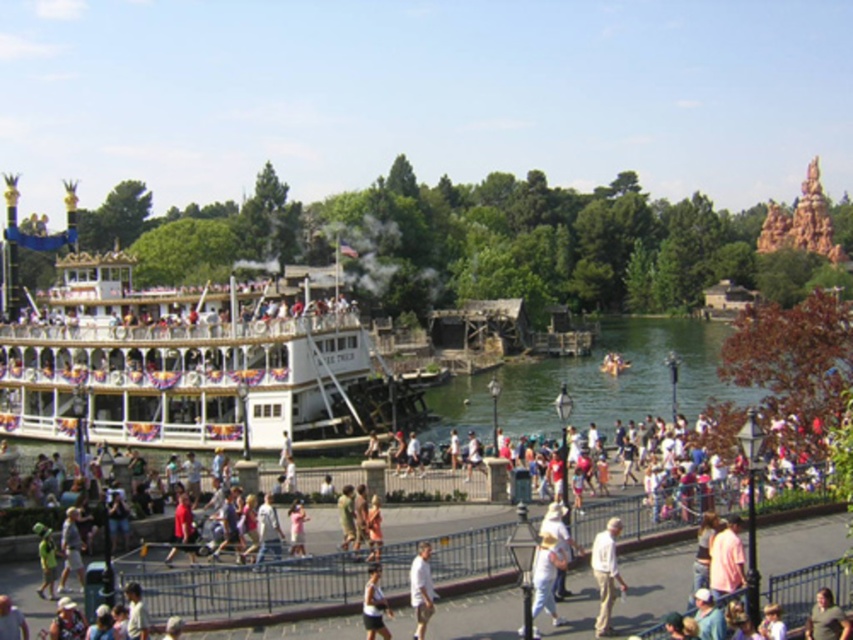
How far apart are white cotton shirt at lower center and light brown leather jacket at center?

They are 10.69 meters apart.

Is point (558, 556) farther from camera compared to point (844, 618)?

Yes, it is.

Image resolution: width=853 pixels, height=640 pixels. I want to click on white cotton shirt at lower center, so tap(546, 577).

Between pink fabric shirt at lower right and white cotton shirt at center, which one is positioned higher?

Positioned higher is pink fabric shirt at lower right.

Consider the image. Is pink fabric shirt at lower right taller than white cotton shirt at center?

Indeed, pink fabric shirt at lower right has a greater height compared to white cotton shirt at center.

At what (x,y) coordinates should I click in order to perform the action: click on pink fabric shirt at lower right. Please return your answer as a coordinate pair (x, y). The image size is (853, 640). Looking at the image, I should click on (726, 557).

Between pink fabric shirt at lower right and light brown leather jacket at center, which one appears on the left side from the viewer's perspective?

From the viewer's perspective, pink fabric shirt at lower right appears more on the left side.

Who is more forward, (x=737, y=547) or (x=816, y=618)?

Point (x=816, y=618) is more forward.

What are the coordinates of `pink fabric shirt at lower right` in the screenshot? It's located at (726, 557).